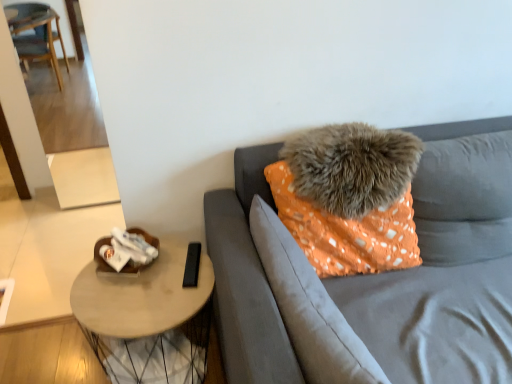
This screenshot has width=512, height=384. Describe the element at coordinates (380, 273) in the screenshot. I see `orange fabric pillow at upper right` at that location.

Find the location of a particular element. This screenshot has height=384, width=512. light brown wooden table at lower left is located at coordinates (147, 319).

The image size is (512, 384). What do you see at coordinates (352, 167) in the screenshot?
I see `fuzzy orange pillow at center, the second pillow in the bottom-to-top sequence` at bounding box center [352, 167].

Describe the element at coordinates (309, 308) in the screenshot. I see `orange fabric pillow at center, the 1th pillow ordered from the bottom` at that location.

Image resolution: width=512 pixels, height=384 pixels. I want to click on orange fabric pillow at center, the second pillow in the top-to-bottom sequence, so click(x=309, y=308).

Where is `orange fabric pillow at upper right`? orange fabric pillow at upper right is located at coordinates (380, 273).

From the image's perspective, is fuzzy orange pillow at center, which appears as the first pillow when viewed from the top, beneath light brown wooden table at lower left?

No.

From a real-world perspective, which is physically above, fuzzy orange pillow at center, the second pillow in the bottom-to-top sequence, or light brown wooden table at lower left?

fuzzy orange pillow at center, the second pillow in the bottom-to-top sequence.

Which object is positioned more to the left, fuzzy orange pillow at center, the second pillow in the bottom-to-top sequence, or light brown wooden table at lower left?

light brown wooden table at lower left is more to the left.

Which is closer to the camera, (392, 134) or (207, 326)?

Point (392, 134)

Can you tell me how much orange fabric pillow at upper right and fuzzy orange pillow at center, which appears as the first pillow when viewed from the top, differ in facing direction?

1.3 degrees separate the facing orientations of orange fabric pillow at upper right and fuzzy orange pillow at center, which appears as the first pillow when viewed from the top.

Is orange fabric pillow at upper right bigger than fuzzy orange pillow at center, which appears as the first pillow when viewed from the top?

Indeed, orange fabric pillow at upper right has a larger size compared to fuzzy orange pillow at center, which appears as the first pillow when viewed from the top.

The width and height of the screenshot is (512, 384). I want to click on studio couch beneath the fuzzy orange pillow at center, which appears as the first pillow when viewed from the top (from a real-world perspective), so click(380, 273).

Considering the positions of objects fuzzy orange pillow at center, which appears as the first pillow when viewed from the top, and orange fabric pillow at upper right in the image provided, who is more to the right, fuzzy orange pillow at center, which appears as the first pillow when viewed from the top, or orange fabric pillow at upper right?

orange fabric pillow at upper right is more to the right.

Based on the photo, considering the sizes of objects fuzzy orange pillow at center, the second pillow in the bottom-to-top sequence, and orange fabric pillow at upper right in the image provided, who is shorter, fuzzy orange pillow at center, the second pillow in the bottom-to-top sequence, or orange fabric pillow at upper right?

fuzzy orange pillow at center, the second pillow in the bottom-to-top sequence, is shorter.

In the scene shown: Is fuzzy orange pillow at center, which appears as the first pillow when viewed from the top, not close to orange fabric pillow at upper right?

No, fuzzy orange pillow at center, which appears as the first pillow when viewed from the top, is not far away from orange fabric pillow at upper right.

From a real-world perspective, is fuzzy orange pillow at center, the second pillow in the bottom-to-top sequence, physically above orange fabric pillow at upper right?

Yes, from a real-world perspective, fuzzy orange pillow at center, the second pillow in the bottom-to-top sequence, is over orange fabric pillow at upper right

Which is more to the right, light brown wooden table at lower left or fuzzy orange pillow at center, which appears as the first pillow when viewed from the top?

From the viewer's perspective, fuzzy orange pillow at center, which appears as the first pillow when viewed from the top, appears more on the right side.

Are light brown wooden table at lower left and fuzzy orange pillow at center, which appears as the first pillow when viewed from the top, making contact?

No, light brown wooden table at lower left is not making contact with fuzzy orange pillow at center, which appears as the first pillow when viewed from the top.

Between light brown wooden table at lower left and fuzzy orange pillow at center, the second pillow in the bottom-to-top sequence, which one has more height?

With more height is light brown wooden table at lower left.

From a real-world perspective, which object stands above the other?

orange fabric pillow at center, the 1th pillow ordered from the bottom, from a real-world perspective.

Consider the image. Could you tell me if orange fabric pillow at upper right is turned towards orange fabric pillow at center, the second pillow in the top-to-bottom sequence?

Yes.

Considering the sizes of orange fabric pillow at upper right and orange fabric pillow at center, the second pillow in the top-to-bottom sequence, in the image, is orange fabric pillow at upper right wider or thinner than orange fabric pillow at center, the second pillow in the top-to-bottom sequence,?

Considering their sizes, orange fabric pillow at upper right looks broader than orange fabric pillow at center, the second pillow in the top-to-bottom sequence.

Based on the photo, does light brown wooden table at lower left have a lesser width compared to orange fabric pillow at upper right?

Yes.

Does light brown wooden table at lower left touch orange fabric pillow at upper right?

No.

From the image's perspective, is light brown wooden table at lower left located above or below orange fabric pillow at upper right?

Based on their image positions, light brown wooden table at lower left is located beneath orange fabric pillow at upper right.

Looking at this image, from the image's perspective, does orange fabric pillow at center, the second pillow in the top-to-bottom sequence, appear lower than orange fabric pillow at upper right?

Yes, from the image's perspective, orange fabric pillow at center, the second pillow in the top-to-bottom sequence, is beneath orange fabric pillow at upper right.

From a real-world perspective, is orange fabric pillow at center, the 1th pillow ordered from the bottom, over orange fabric pillow at upper right?

Yes, from a real-world perspective, orange fabric pillow at center, the 1th pillow ordered from the bottom, is on top of orange fabric pillow at upper right.

Image resolution: width=512 pixels, height=384 pixels. I want to click on studio couch above the orange fabric pillow at center, the second pillow in the top-to-bottom sequence (from the image's perspective), so click(x=380, y=273).

Is orange fabric pillow at center, the second pillow in the top-to-bottom sequence, thinner than orange fabric pillow at upper right?

Yes, orange fabric pillow at center, the second pillow in the top-to-bottom sequence, is thinner than orange fabric pillow at upper right.

You are a GUI agent. You are given a task and a screenshot of the screen. Output one action in this format:
    pyautogui.click(x=<x>, y=<y>)
    Task: Click on the table beneath the fuzzy orange pillow at center, which appears as the first pillow when viewed from the top (from a real-world perspective)
    This screenshot has width=512, height=384.
    Given the screenshot: What is the action you would take?
    pyautogui.click(x=147, y=319)

Locate an element on the screen. The height and width of the screenshot is (384, 512). studio couch located in front of the fuzzy orange pillow at center, the second pillow in the bottom-to-top sequence is located at coordinates (x=380, y=273).

Estimate the real-world distances between objects in this image. Which object is further from orange fabric pillow at center, the 1th pillow ordered from the bottom, orange fabric pillow at upper right or fuzzy orange pillow at center, which appears as the first pillow when viewed from the top?

fuzzy orange pillow at center, which appears as the first pillow when viewed from the top, is positioned further to the anchor orange fabric pillow at center, the 1th pillow ordered from the bottom.

Considering their positions, is fuzzy orange pillow at center, which appears as the first pillow when viewed from the top, positioned further to light brown wooden table at lower left than orange fabric pillow at center, the 1th pillow ordered from the bottom?

Among the two, fuzzy orange pillow at center, which appears as the first pillow when viewed from the top, is located further to light brown wooden table at lower left.

Based on their spatial positions, is fuzzy orange pillow at center, the second pillow in the bottom-to-top sequence, or light brown wooden table at lower left further from orange fabric pillow at center, the second pillow in the top-to-bottom sequence?

light brown wooden table at lower left is further to orange fabric pillow at center, the second pillow in the top-to-bottom sequence.

Considering their positions, is fuzzy orange pillow at center, which appears as the first pillow when viewed from the top, positioned closer to light brown wooden table at lower left than orange fabric pillow at upper right?

The object closer to light brown wooden table at lower left is orange fabric pillow at upper right.

Looking at the image, which one is located further to light brown wooden table at lower left, orange fabric pillow at upper right or fuzzy orange pillow at center, which appears as the first pillow when viewed from the top?

The object further to light brown wooden table at lower left is fuzzy orange pillow at center, which appears as the first pillow when viewed from the top.

Considering their positions, is light brown wooden table at lower left positioned further to orange fabric pillow at upper right than orange fabric pillow at center, the 1th pillow ordered from the bottom?

light brown wooden table at lower left lies further to orange fabric pillow at upper right than the other object.

From the image, which object appears to be nearer to orange fabric pillow at upper right, orange fabric pillow at center, the 1th pillow ordered from the bottom, or fuzzy orange pillow at center, which appears as the first pillow when viewed from the top?

The object closer to orange fabric pillow at upper right is orange fabric pillow at center, the 1th pillow ordered from the bottom.

Looking at the image, which one is located closer to orange fabric pillow at upper right, fuzzy orange pillow at center, the second pillow in the bottom-to-top sequence, or light brown wooden table at lower left?

fuzzy orange pillow at center, the second pillow in the bottom-to-top sequence, lies closer to orange fabric pillow at upper right than the other object.

This screenshot has height=384, width=512. What are the coordinates of `pillow situated between light brown wooden table at lower left and fuzzy orange pillow at center, which appears as the first pillow when viewed from the top, from left to right` in the screenshot? It's located at (309, 308).

This screenshot has width=512, height=384. In order to click on pillow located between orange fabric pillow at upper right and fuzzy orange pillow at center, the second pillow in the bottom-to-top sequence, in the depth direction in this screenshot , I will do `click(309, 308)`.